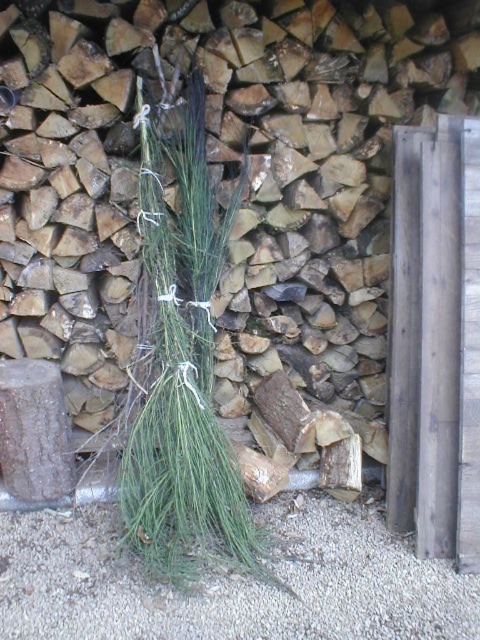
You are standing in a garden and see a green grass bundle at center. You want to place a small decorative stone exactly at point [320,154]. Is this point currently occupied by the green grass bundle at center?

Yes, the point [320,154] is occupied by the green grass bundle at center, so placing the stone there would require moving the bundle first.

You are designing a garden path and need to choose between the gray gravel at lower center and the green grass at center. Which material has a wider spread in the image?

The gray gravel at lower center has a larger width than the green grass at center according to the description.